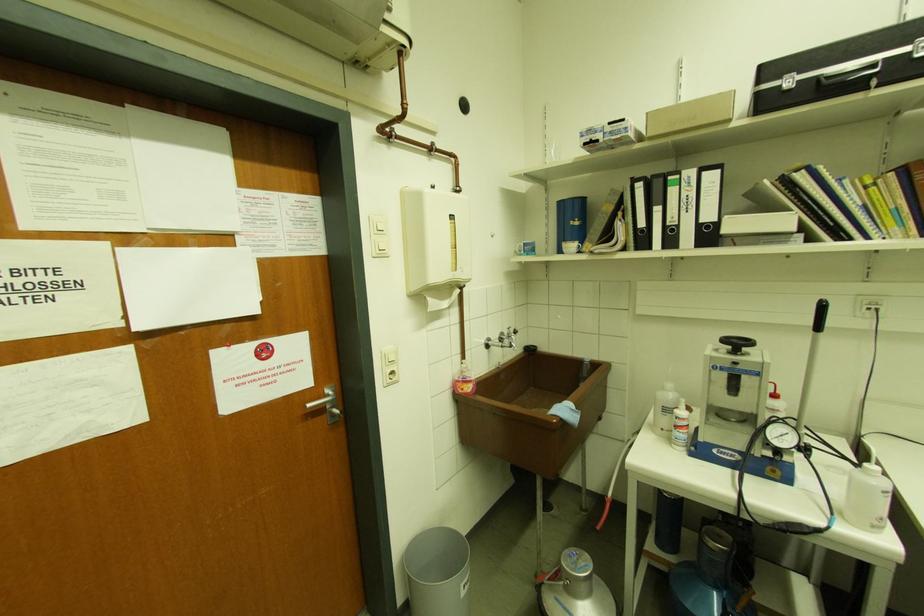
Describe the element at coordinates (681, 426) in the screenshot. This screenshot has height=616, width=924. I see `the white plastic bottle` at that location.